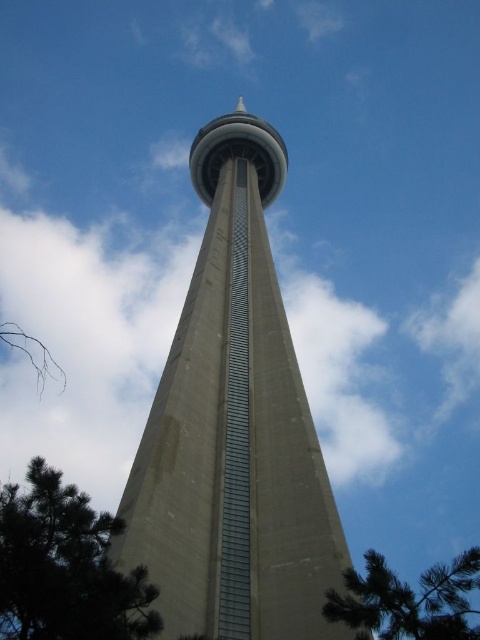
You are standing in a park and see the concrete tower at center and the green leafy tree at lower left. Which object is taller?

The concrete tower at center is taller than the green leafy tree at lower left.

Based on the coordinates provided, which object is located at point [233,428] in the scene?

The point [233,428] corresponds to the concrete tower at center.

You are standing in a park and see the concrete tower at center and the green leafy tree at lower left. Which object is closer to you?

The concrete tower at center is closer to you because it is further to the viewer than the green leafy tree at lower left.